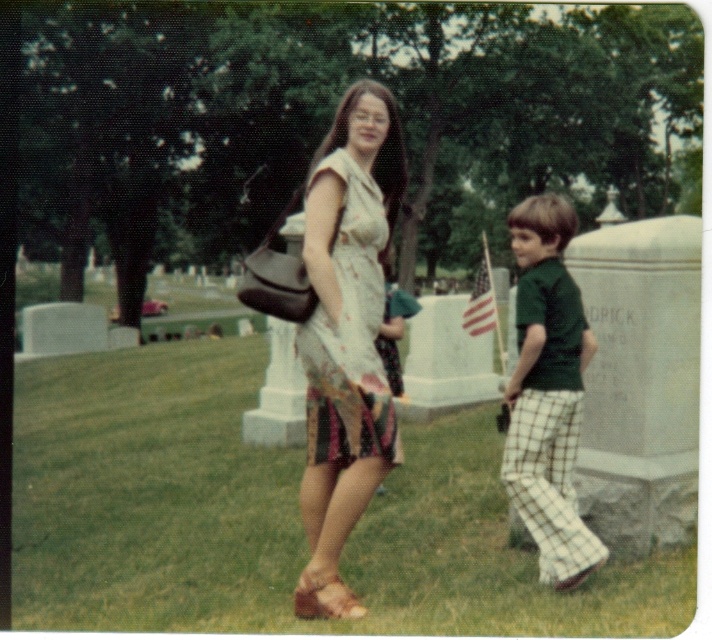
Does matte floral dress at center have a greater width compared to green textured shirt at right?

Incorrect, matte floral dress at center's width does not surpass green textured shirt at right's.

Can you confirm if matte floral dress at center is shorter than green textured shirt at right?

Yes.

Which is in front, point (310, 253) or point (544, 579)?

Point (310, 253) is more forward.

Locate an element on the screen. This screenshot has width=712, height=640. matte floral dress at center is located at coordinates [347, 316].

Does green textured shirt at right have a smaller size compared to printed fabric dress at center?

No.

Can you confirm if green textured shirt at right is wider than printed fabric dress at center?

No, green textured shirt at right is not wider than printed fabric dress at center.

At what (x,y) coordinates should I click in order to perform the action: click on green textured shirt at right. Please return your answer as a coordinate pair (x, y). Looking at the image, I should click on (548, 392).

Is green grass at center thinner than green textured shirt at right?

No.

The width and height of the screenshot is (712, 640). Identify the location of green grass at center. (271, 515).

Where is `green grass at center`? This screenshot has width=712, height=640. green grass at center is located at coordinates (271, 515).